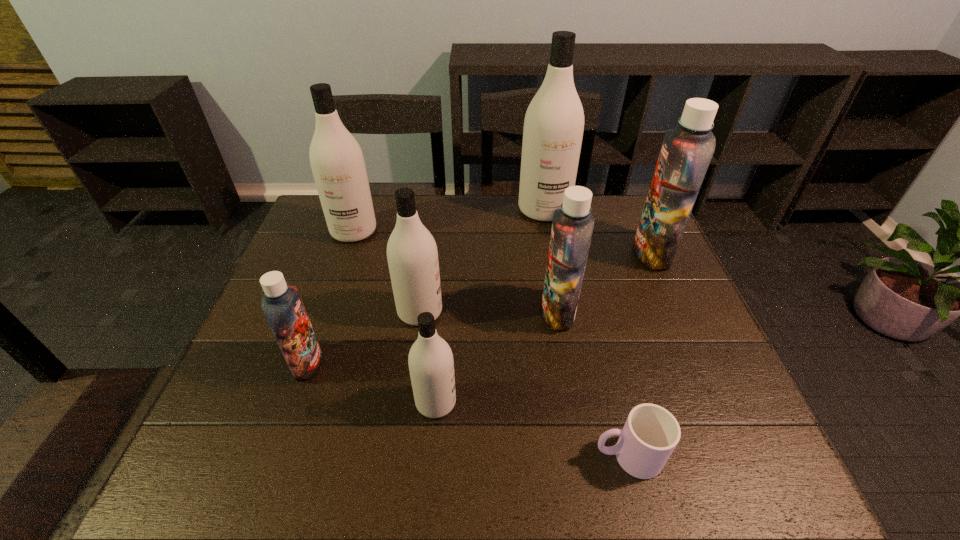
Where is `free space between the third biggest white shampoo and the cup`? The image size is (960, 540). free space between the third biggest white shampoo and the cup is located at coordinates (524, 384).

Locate an element on the screen. Image resolution: width=960 pixels, height=540 pixels. free space between the leftmost blue shampoo and the nearest white shampoo is located at coordinates (372, 382).

Where is `vacant area that lies between the nearest white shampoo and the shortest object`? vacant area that lies between the nearest white shampoo and the shortest object is located at coordinates pos(532,429).

You are a GUI agent. You are given a task and a screenshot of the screen. Output one action in this format:
    pyautogui.click(x=<x>, y=<y>)
    Task: Click on the unoccupied position between the second biggest blue shampoo and the nearest white shampoo
    The image size is (960, 540).
    Given the screenshot: What is the action you would take?
    pyautogui.click(x=497, y=357)

You are a GUI agent. You are given a task and a screenshot of the screen. Output one action in this format:
    pyautogui.click(x=<x>, y=<y>)
    Task: Click on the seventh closest object to the leftmost white shampoo
    
    Given the screenshot: What is the action you would take?
    pyautogui.click(x=650, y=434)

Point out which object is positioned as the second nearest to the nearest white shampoo. Please provide its 2D coordinates. Your answer should be formatted as a tuple, i.e. [(x, y)], where the tuple contains the x and y coordinates of a point satisfying the conditions above.

[(282, 306)]

Identify the location of shampoo identified as the closest to the tallest object. The image size is (960, 540). point(686,152).

The height and width of the screenshot is (540, 960). I want to click on shampoo that is the second nearest to the second biggest blue shampoo, so click(431, 364).

Identify the location of the closest white shampoo to the farthest blue shampoo. Image resolution: width=960 pixels, height=540 pixels. (553, 129).

Identify which white shampoo is the third closest to the second farthest blue shampoo. Please provide its 2D coordinates. Your answer should be formatted as a tuple, i.e. [(x, y)], where the tuple contains the x and y coordinates of a point satisfying the conditions above.

[(553, 129)]